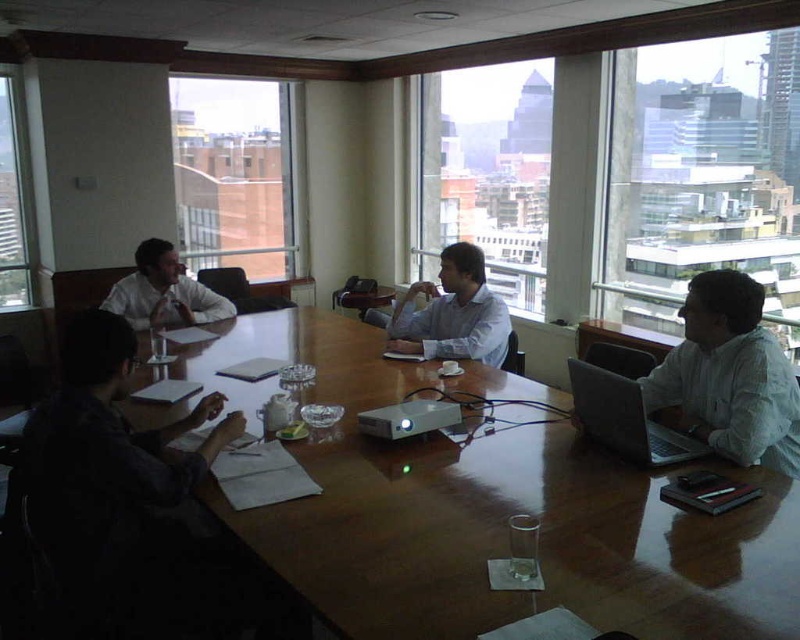
Does point (442, 595) come in front of point (274, 113)?

Yes, it is.

What do you see at coordinates (492, 509) in the screenshot? The height and width of the screenshot is (640, 800). I see `wooden table at center` at bounding box center [492, 509].

Locate an element on the screen. wooden table at center is located at coordinates (492, 509).

This screenshot has width=800, height=640. What do you see at coordinates (454, 314) in the screenshot?
I see `light blue shirt at center` at bounding box center [454, 314].

Who is shorter, light blue shirt at center or transparent glass window at upper center?

With less height is transparent glass window at upper center.

The height and width of the screenshot is (640, 800). What do you see at coordinates (454, 314) in the screenshot?
I see `light blue shirt at center` at bounding box center [454, 314].

Find the location of a particular element. light blue shirt at center is located at coordinates (454, 314).

Does transparent glass window at upper right have a smaller size compared to silver metallic laptop at right?

No, transparent glass window at upper right is not smaller than silver metallic laptop at right.

Can you confirm if transparent glass window at upper right is wider than silver metallic laptop at right?

Indeed, transparent glass window at upper right has a greater width compared to silver metallic laptop at right.

Measure the distance between point (x=654, y=163) and camera.

The distance of point (x=654, y=163) from camera is 15.36 feet.

At what (x,y) coordinates should I click in order to perform the action: click on transparent glass window at upper right. Please return your answer as a coordinate pair (x, y). The width and height of the screenshot is (800, 640). Looking at the image, I should click on (704, 176).